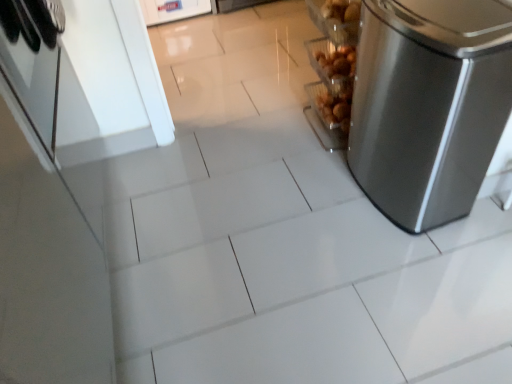
I want to click on free spot to the left of satin silver trash can at right, so click(310, 196).